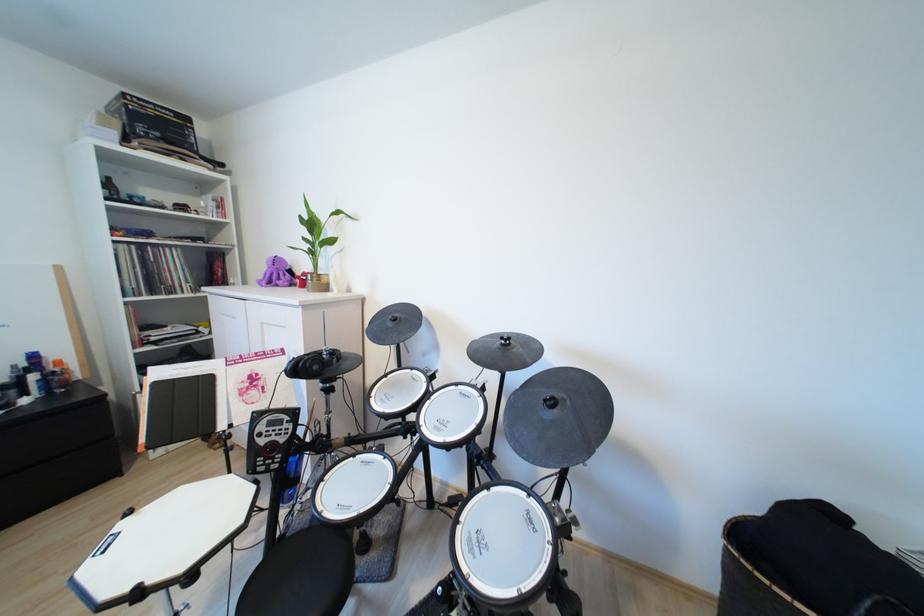
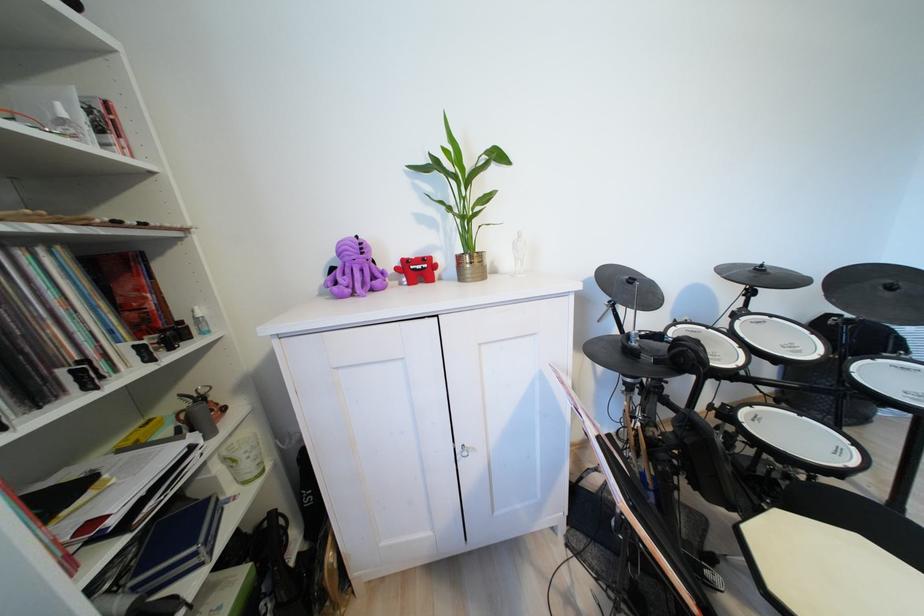
Where in the second image is the point corresponding to the point at 419,370 from the first image?

(682, 326)